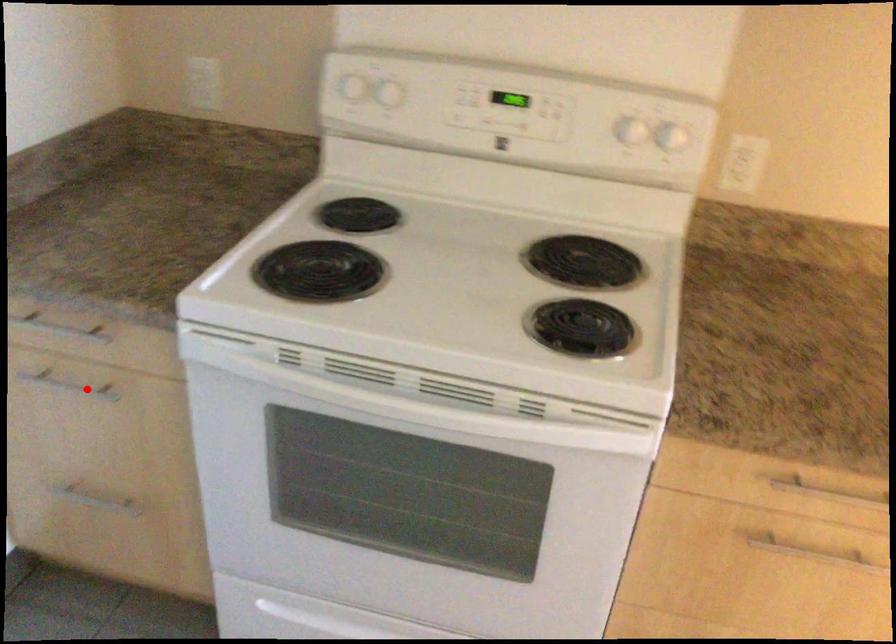
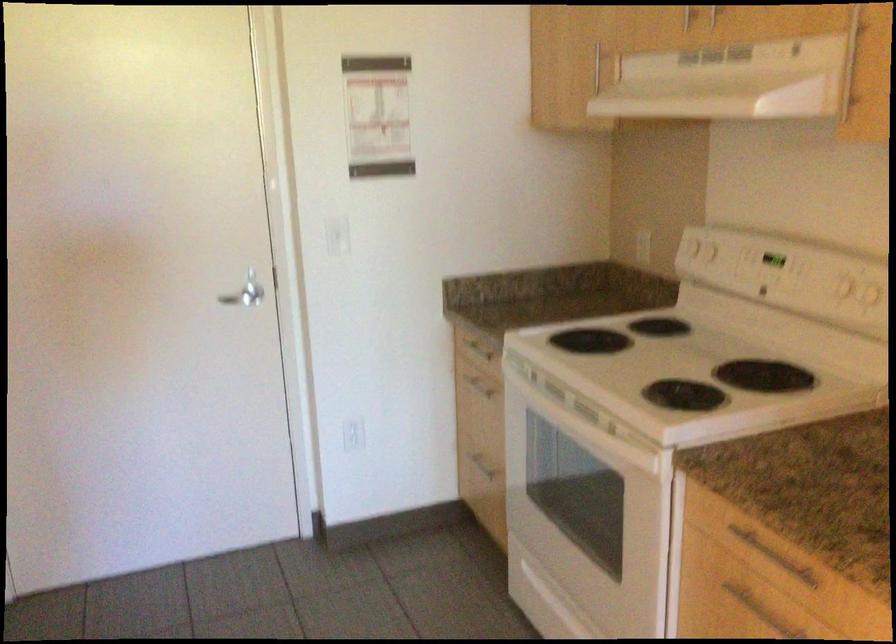
Question: I am providing you with two images of the same scene from different viewpoints. Image1 has a red point marked. In image2, the corresponding 3D location appears at what relative position? Reply with the corresponding letter.

Choices:
 (A) Closer
 (B) Farther

Answer: (B)